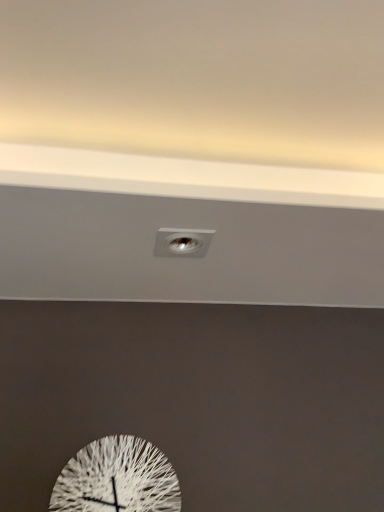
Question: Looking at the image, does metallic silver light fixture at center seem bigger or smaller compared to white textured clock at center?

Choices:
 (A) big
 (B) small

Answer: (B)

Question: Does point (195, 249) appear closer or farther from the camera than point (152, 445)?

Choices:
 (A) farther
 (B) closer

Answer: (B)

Question: Is metallic silver light fixture at center wider or thinner than white textured clock at center?

Choices:
 (A) wide
 (B) thin

Answer: (A)

Question: Would you say white textured clock at center is inside or outside metallic silver light fixture at center?

Choices:
 (A) outside
 (B) inside

Answer: (A)

Question: In terms of height, does white textured clock at center look taller or shorter compared to metallic silver light fixture at center?

Choices:
 (A) tall
 (B) short

Answer: (A)

Question: Is white textured clock at center bigger or smaller than metallic silver light fixture at center?

Choices:
 (A) small
 (B) big

Answer: (B)

Question: From a real-world perspective, is white textured clock at center above or below metallic silver light fixture at center?

Choices:
 (A) below
 (B) above

Answer: (A)